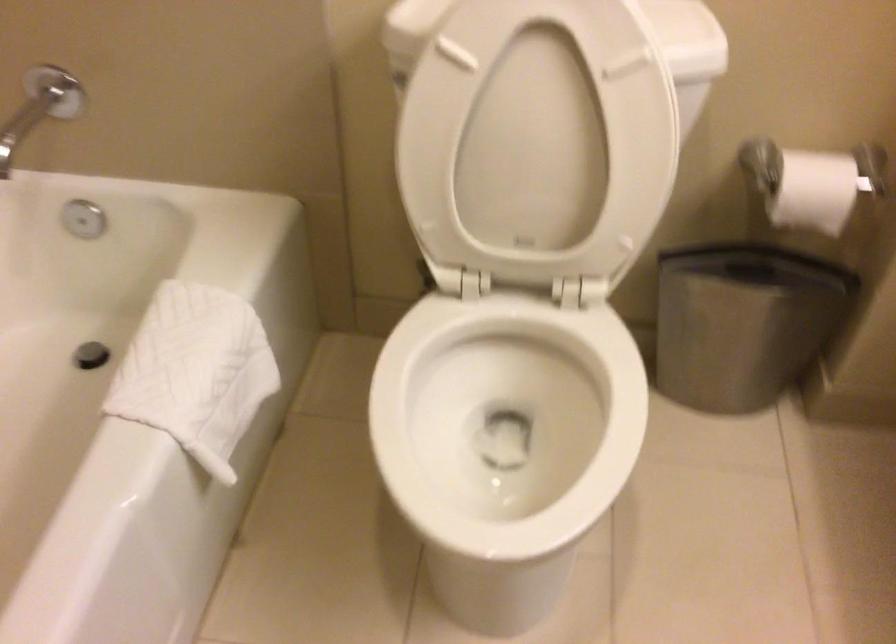
Identify the location of white toilet seat. The width and height of the screenshot is (896, 644). (505, 420).